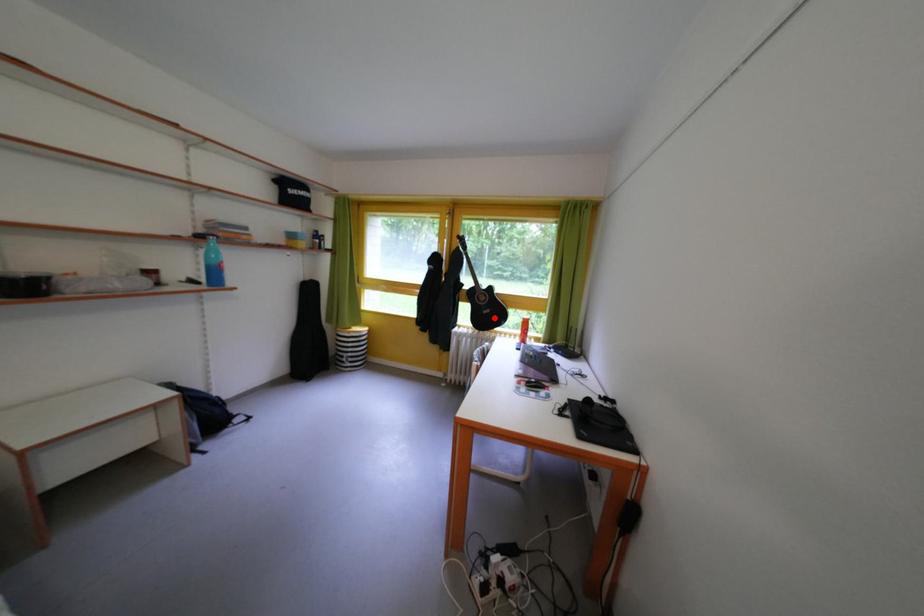
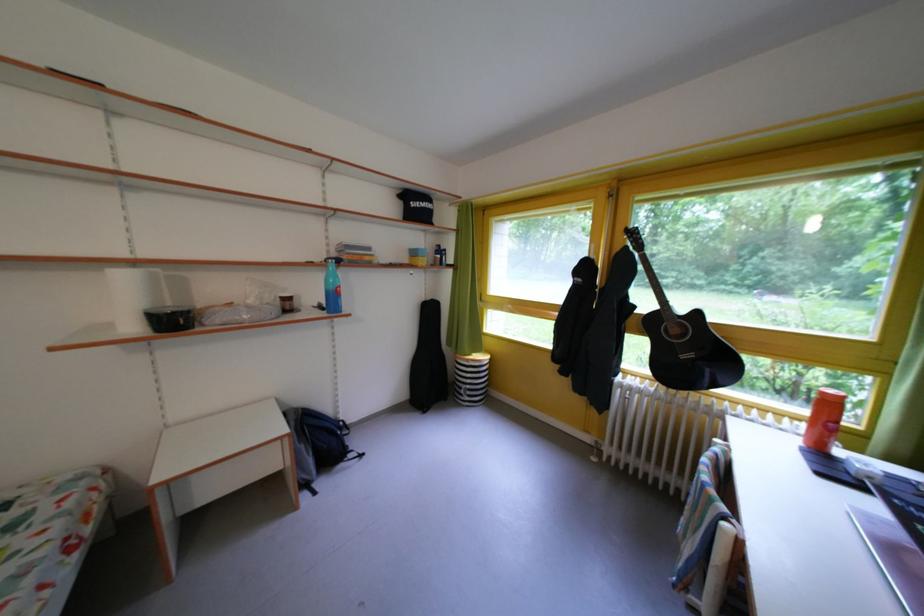
Question: A red point is marked in image1. In image2, is the corresponding 3D point closer to the camera or farther? Reply with the corresponding letter.

Choices:
 (A) The corresponding 3D point is closer.
 (B) The corresponding 3D point is farther.

Answer: (A)